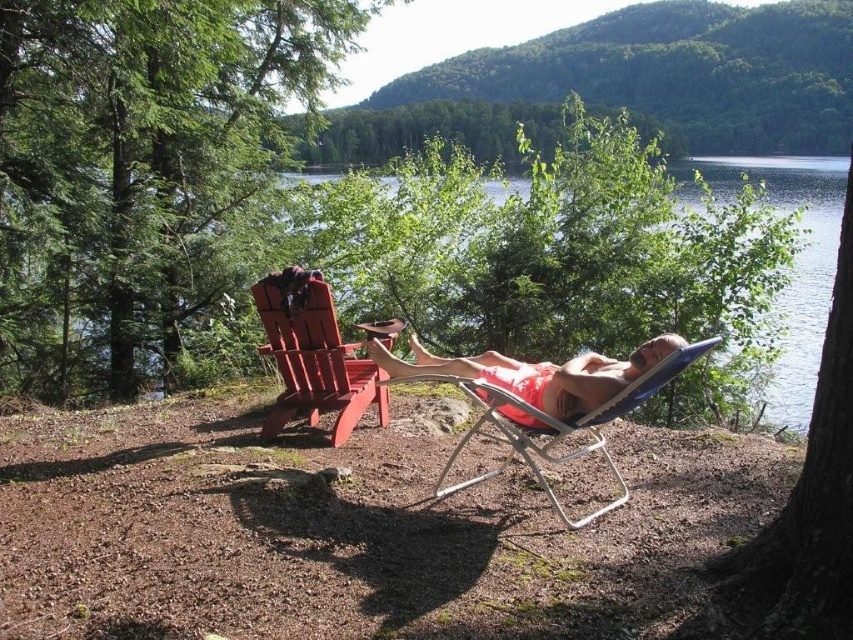
You are standing at the lakeside and want to place a 6.5 feet long wooden bench between the blue folding chair and the green leafy tree at right. Is there enough space?

The distance between the blue folding chair and the green leafy tree at right is 6.45 feet, which is slightly shorter than the 6.5 feet long bench. Therefore, there isn

Based on the photo, you are a photographer planning to take a portrait of someone sitting in the smooth wood beach chair at left. To ensure the green leafy tree at right doesn not block the background, where should you position the chair?

The green leafy tree at right is positioned under the smooth wood beach chair at left, so to avoid blocking the background, you should move the smooth wood beach chair at left away from the green leafy tree at right.